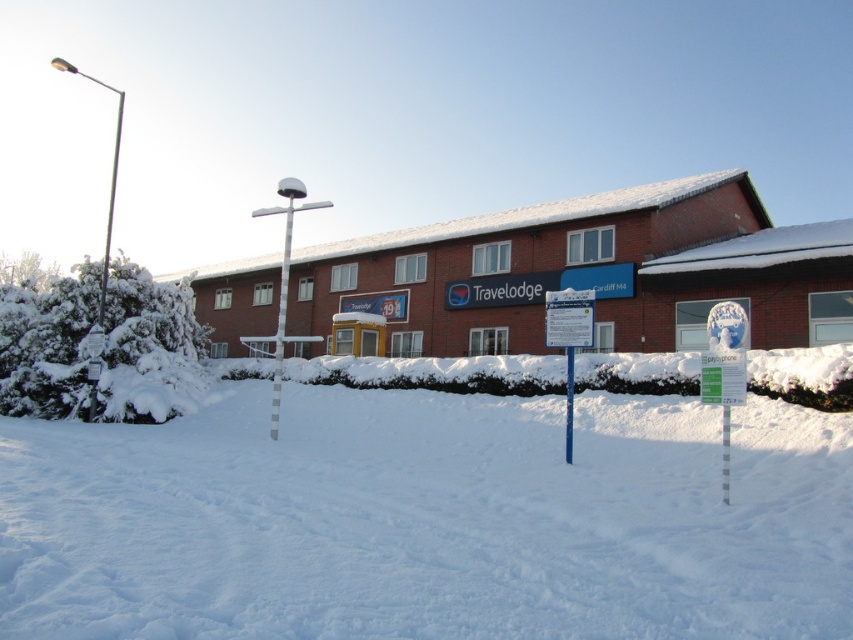
Question: Can you confirm if white fluffy snow at center is bigger than blue plastic sign at center?

Choices:
 (A) yes
 (B) no

Answer: (A)

Question: Considering the relative positions of white striped pole at center and white plastic pole at center in the image provided, where is white striped pole at center located with respect to white plastic pole at center?

Choices:
 (A) below
 (B) above

Answer: (B)

Question: Which point is farther to the camera?

Choices:
 (A) white fluffy snow at center
 (B) blue plastic sign at center
 (C) white striped pole at center

Answer: (C)

Question: Which object is positioned farthest from the white plastic pole at center?

Choices:
 (A) blue plastic sign at center
 (B) white fluffy snow at center
 (C) white striped pole at center

Answer: (C)

Question: Among these objects, which one is farthest from the camera?

Choices:
 (A) white fluffy snow at center
 (B) white plastic pole at center
 (C) blue plastic sign at center
 (D) white striped pole at center

Answer: (D)

Question: Is white striped pole at center smaller than white plastic pole at center?

Choices:
 (A) no
 (B) yes

Answer: (A)